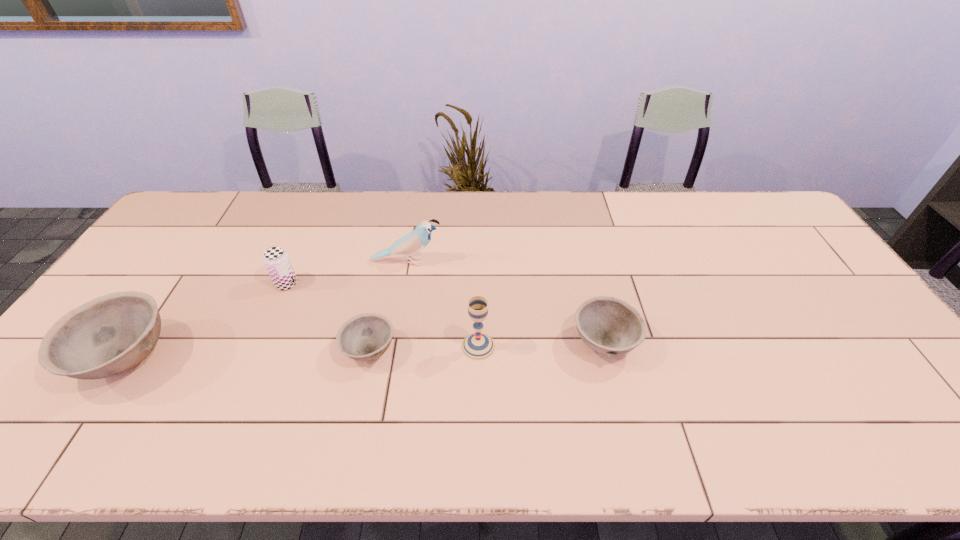
You are a GUI agent. You are given a task and a screenshot of the screen. Output one action in this format:
    pyautogui.click(x=<x>, y=<y>)
    Task: Click on the vacant space that satisfies the following two spatial constraints: 1. on the back side of the fifth nearest object; 2. on the right side of the tallest bowl
    The width and height of the screenshot is (960, 540).
    Given the screenshot: What is the action you would take?
    pyautogui.click(x=178, y=284)